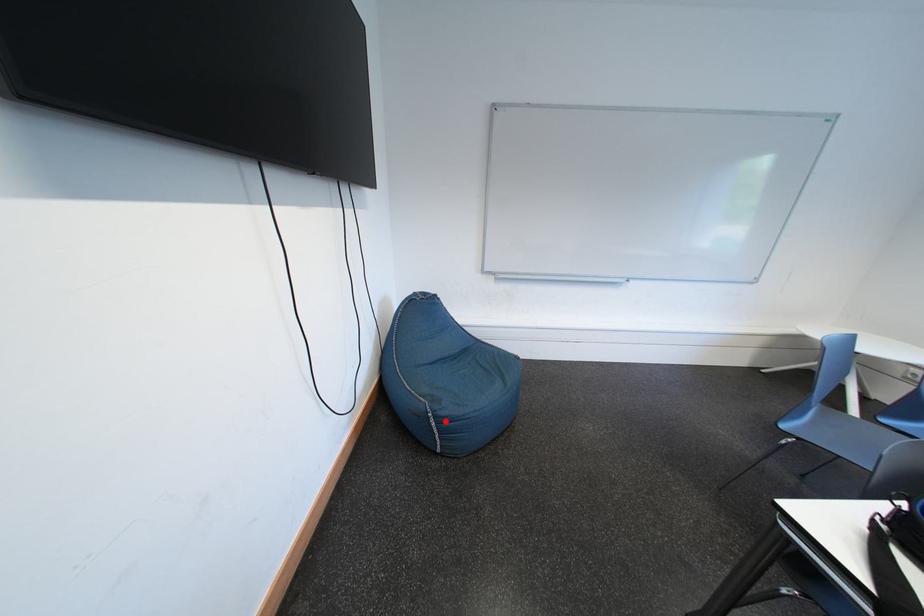
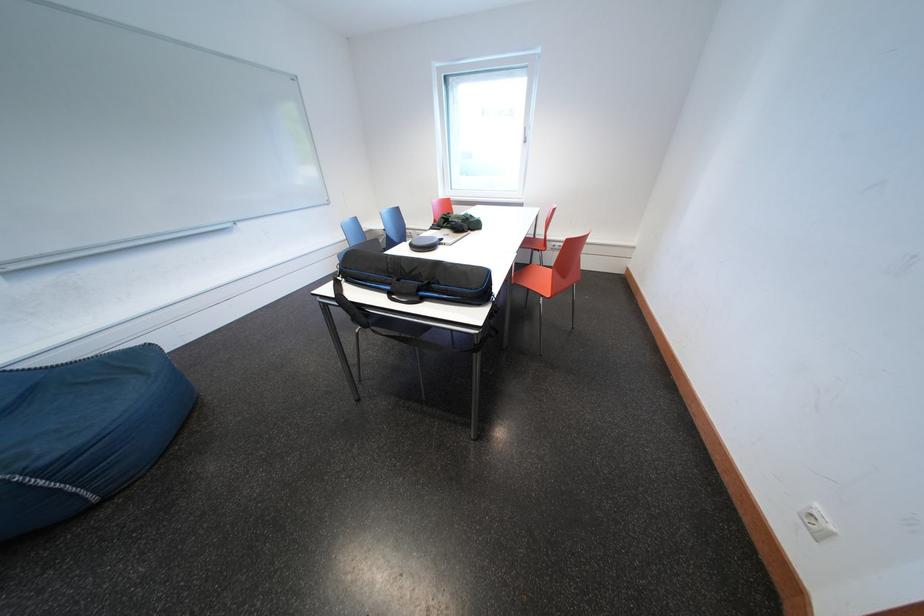
Question: I am providing you with two images of the same scene from different viewpoints. In image1, a red point is highlighted. Considering the same 3D point in image2, which of the following is correct?

Choices:
 (A) It is closer
 (B) It is farther

Answer: (B)